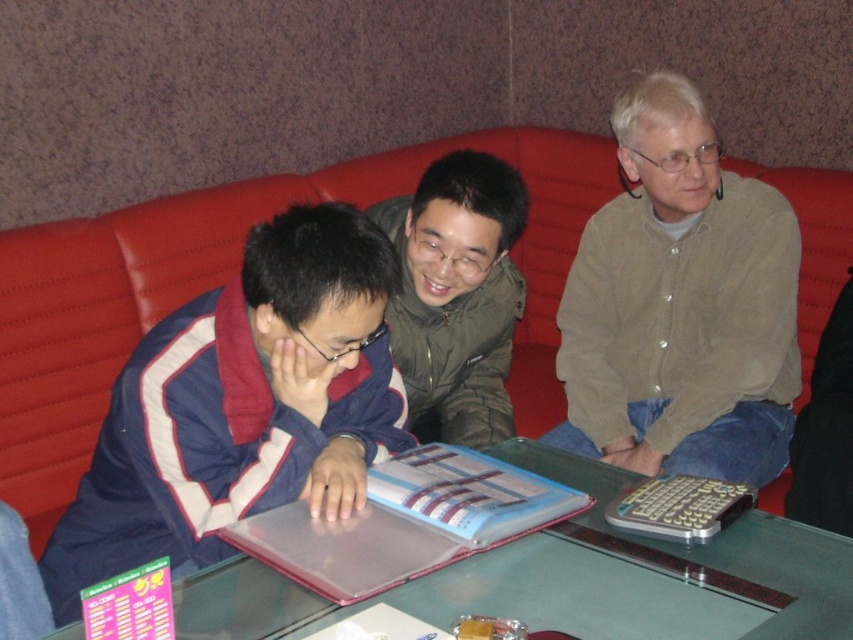
Where is `blue fabric jacket at center`? The image size is (853, 640). blue fabric jacket at center is located at coordinates (242, 404).

Does point (334, 284) come in front of point (648, 548)?

That is True.

Locate an element on the screen. This screenshot has height=640, width=853. blue fabric jacket at center is located at coordinates (242, 404).

Where is `light brown button-down shirt at right`? This screenshot has height=640, width=853. light brown button-down shirt at right is located at coordinates coord(680,305).

Is light brown button-down shirt at right thinner than transparent plastic folder at center?

Indeed, light brown button-down shirt at right has a lesser width compared to transparent plastic folder at center.

Describe the element at coordinates (680, 305) in the screenshot. This screenshot has width=853, height=640. I see `light brown button-down shirt at right` at that location.

Locate an element on the screen. light brown button-down shirt at right is located at coordinates (680, 305).

Which of these two, blue fabric jacket at center or light brown button-down shirt at right, stands taller?

With more height is light brown button-down shirt at right.

Is blue fabric jacket at center above light brown button-down shirt at right?

Incorrect, blue fabric jacket at center is not positioned above light brown button-down shirt at right.

Is point (166, 332) positioned behind point (763, 257)?

No, (166, 332) is in front of (763, 257).

Where is `blue fabric jacket at center`? The image size is (853, 640). blue fabric jacket at center is located at coordinates (242, 404).